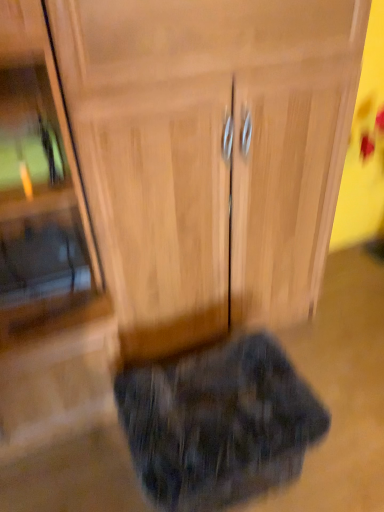
Question: Is wooden cabinet at center surrounding wooden cabinet at center?

Choices:
 (A) no
 (B) yes

Answer: (A)

Question: Is wooden cabinet at center turned away from wooden cabinet at center?

Choices:
 (A) no
 (B) yes

Answer: (A)

Question: Does wooden cabinet at center appear on the left side of wooden cabinet at center?

Choices:
 (A) yes
 (B) no

Answer: (A)

Question: From the image's perspective, is wooden cabinet at center located beneath wooden cabinet at center?

Choices:
 (A) no
 (B) yes

Answer: (B)

Question: Can you confirm if wooden cabinet at center is positioned to the right of wooden cabinet at center?

Choices:
 (A) yes
 (B) no

Answer: (B)

Question: In the image, is wooden cabinet at center on the left side or the right side of wooden cabinet at center?

Choices:
 (A) right
 (B) left

Answer: (A)

Question: Based on their sizes in the image, would you say wooden cabinet at center is bigger or smaller than wooden cabinet at center?

Choices:
 (A) small
 (B) big

Answer: (B)

Question: Is point (147, 307) positioned closer to the camera than point (44, 377)?

Choices:
 (A) closer
 (B) farther

Answer: (B)

Question: From their relative heights in the image, would you say wooden cabinet at center is taller or shorter than wooden cabinet at center?

Choices:
 (A) short
 (B) tall

Answer: (A)

Question: Looking at the image, does fluffy dark gray cat at lower center seem bigger or smaller compared to wooden cabinet at center?

Choices:
 (A) big
 (B) small

Answer: (B)

Question: Which is correct: fluffy dark gray cat at lower center is inside wooden cabinet at center, or outside of it?

Choices:
 (A) outside
 (B) inside

Answer: (A)

Question: In terms of width, does fluffy dark gray cat at lower center look wider or thinner when compared to wooden cabinet at center?

Choices:
 (A) wide
 (B) thin

Answer: (B)

Question: Considering the positions of point click(251, 494) and point click(21, 23), is point click(251, 494) closer or farther from the camera than point click(21, 23)?

Choices:
 (A) farther
 (B) closer

Answer: (A)

Question: Is wooden cabinet at center in front of or behind fluffy dark gray cat at lower center in the image?

Choices:
 (A) behind
 (B) front

Answer: (B)

Question: From their relative heights in the image, would you say wooden cabinet at center is taller or shorter than fluffy dark gray cat at lower center?

Choices:
 (A) short
 (B) tall

Answer: (B)